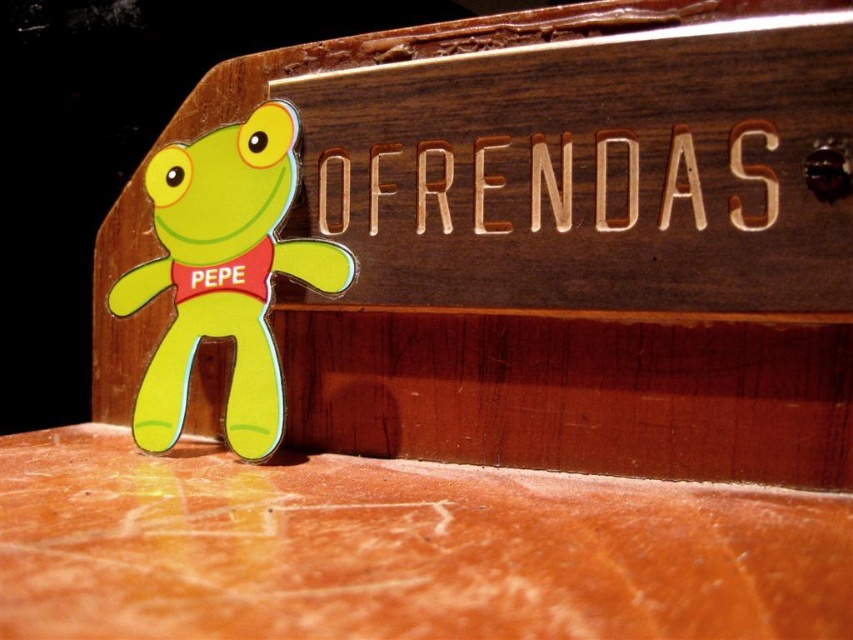
You are setting up an altar for a cultural event and have two wooden signs. You need to place them in a specific arrangement. The wooden sign at upper center and the wooden sign at center must be arranged so that one is to the left of the other. According to the image, which one should be placed to the left?

The wooden sign at upper center should be placed to the left of the wooden sign at center because the wooden sign at upper center is to the left of wooden sign at center.

You are setting up a display for a cultural event and need to arrange items on a shelf. You have a wooden sign at upper center and a matte green plush frog at lower left. Based on their sizes, which item should you place first to ensure proper spacing?

The wooden sign at upper center should be placed first because it is wider than the matte green plush frog at lower left, allowing you to allocate more space for it first.

You are standing in front of the wooden surface with the inscription and the frog. You want to touch both the wooden sign at upper center and the wooden sign at center. Which one should you reach for first to touch the one closer to you?

You should reach for the wooden sign at upper center first because it is closer to you than the wooden sign at center, which is further away.